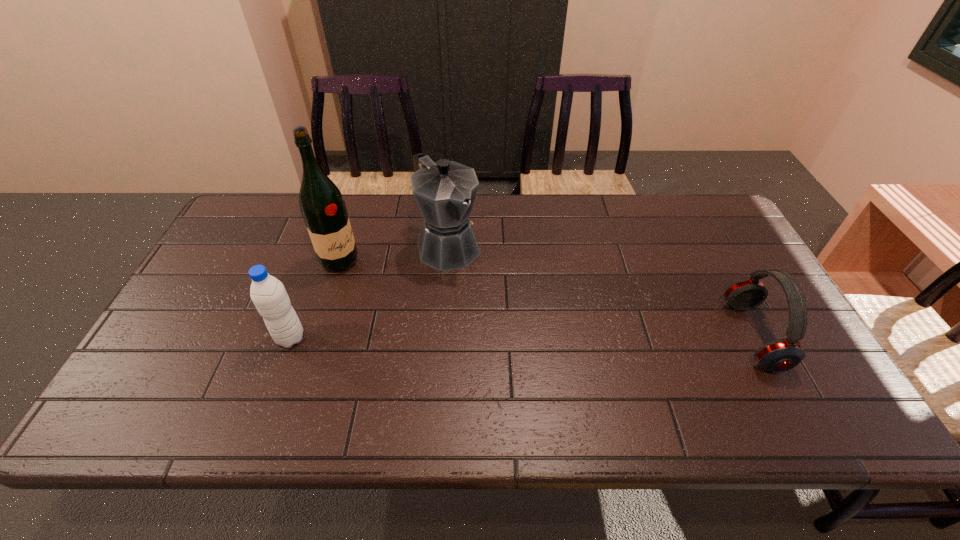
Where is `the third tallest object`? The height and width of the screenshot is (540, 960). the third tallest object is located at coordinates (268, 294).

Find the location of a particular element. This screenshot has height=540, width=960. earphone is located at coordinates (x=783, y=354).

The height and width of the screenshot is (540, 960). Identify the location of the shortest object. (783, 354).

Identify the location of the tallest object. Image resolution: width=960 pixels, height=540 pixels. (322, 205).

The width and height of the screenshot is (960, 540). I want to click on the second tallest object, so click(x=445, y=191).

The height and width of the screenshot is (540, 960). In order to click on the second object from right to left in this screenshot , I will do `click(445, 191)`.

Where is `free space located on the back of the water bottle`? The width and height of the screenshot is (960, 540). free space located on the back of the water bottle is located at coordinates (326, 241).

Where is `free space located on the ear cups of the earphone`? The height and width of the screenshot is (540, 960). free space located on the ear cups of the earphone is located at coordinates (796, 336).

Locate an element on the screen. Image resolution: width=960 pixels, height=540 pixels. vacant region located on the front-facing side of the tallest object is located at coordinates (423, 303).

I want to click on free spot located on the front-facing side of the tallest object, so [x=458, y=320].